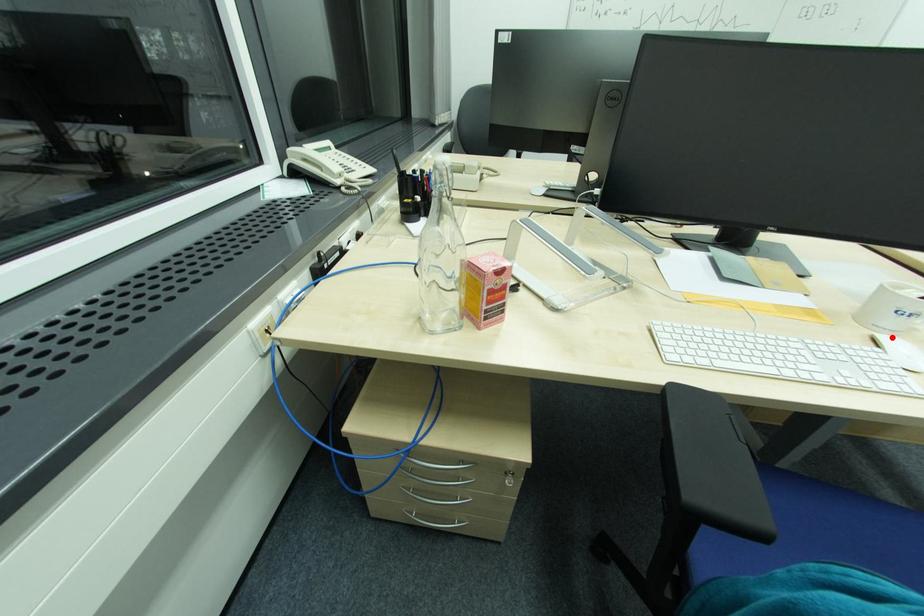
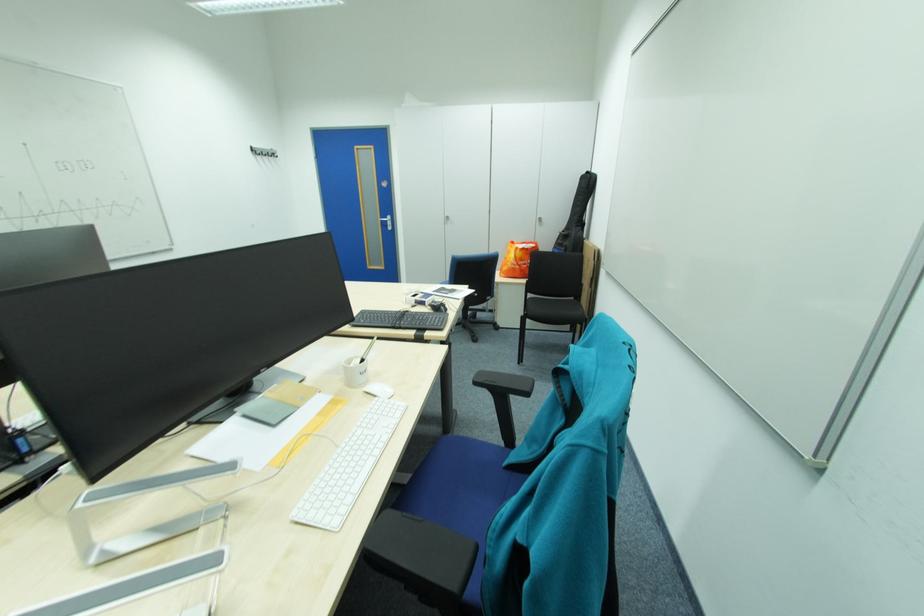
The point at the highlighted location is marked in the first image. Where is the corresponding point in the second image?

(378, 389)